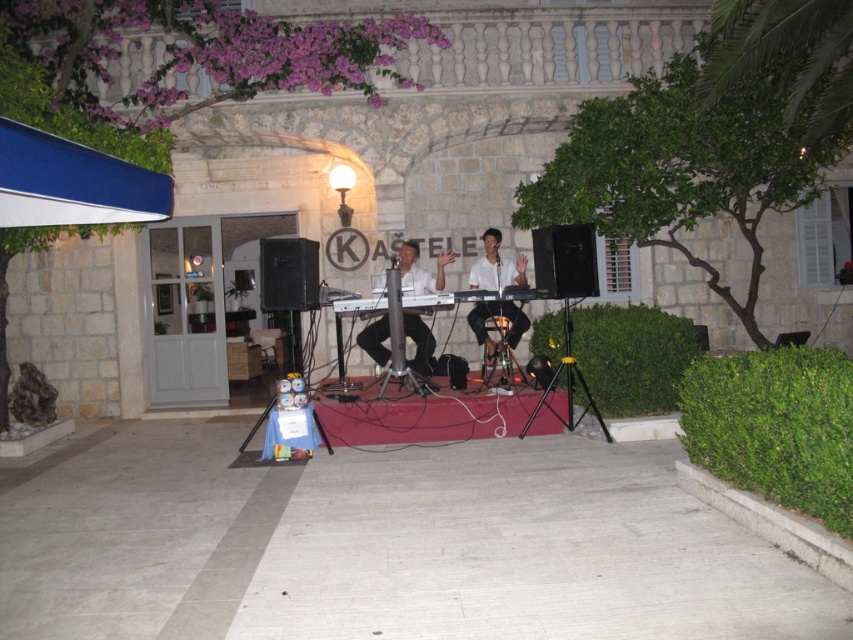
Question: Which of the following is the farthest from the observer?

Choices:
 (A) matte white keyboard at center
 (B) white matte keyboard at center

Answer: (B)

Question: Is matte white keyboard at center thinner than white matte keyboard at center?

Choices:
 (A) yes
 (B) no

Answer: (B)

Question: Can you confirm if matte white keyboard at center is positioned to the left of white matte keyboard at center?

Choices:
 (A) yes
 (B) no

Answer: (A)

Question: Is matte white keyboard at center in front of white matte keyboard at center?

Choices:
 (A) no
 (B) yes

Answer: (B)